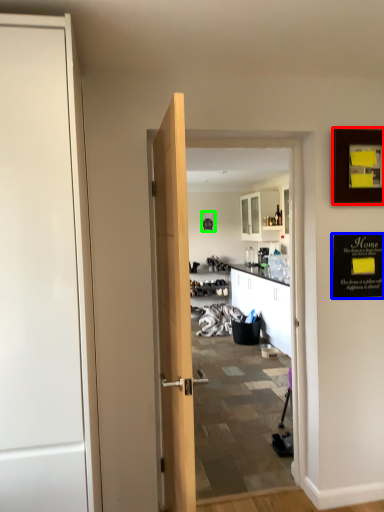
Question: Based on their relative distances, which object is nearer to picture frame (highlighted by a red box)? Choose from bulletin board (highlighted by a blue box) and picture frame (highlighted by a green box).

Choices:
 (A) bulletin board
 (B) picture frame

Answer: (A)